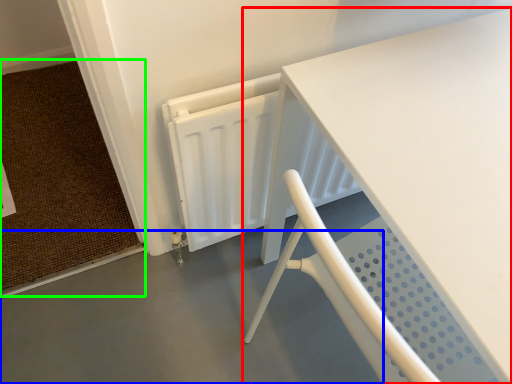
Question: Which object is the closest to the table (highlighted by a red box)? Choose among these: concrete (highlighted by a blue box) or doormat (highlighted by a green box).

Choices:
 (A) concrete
 (B) doormat

Answer: (A)